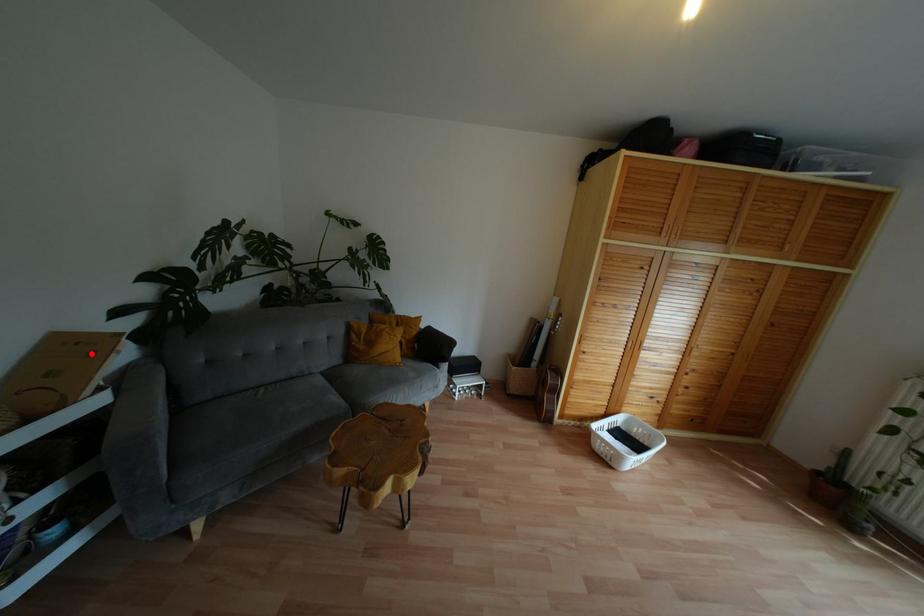
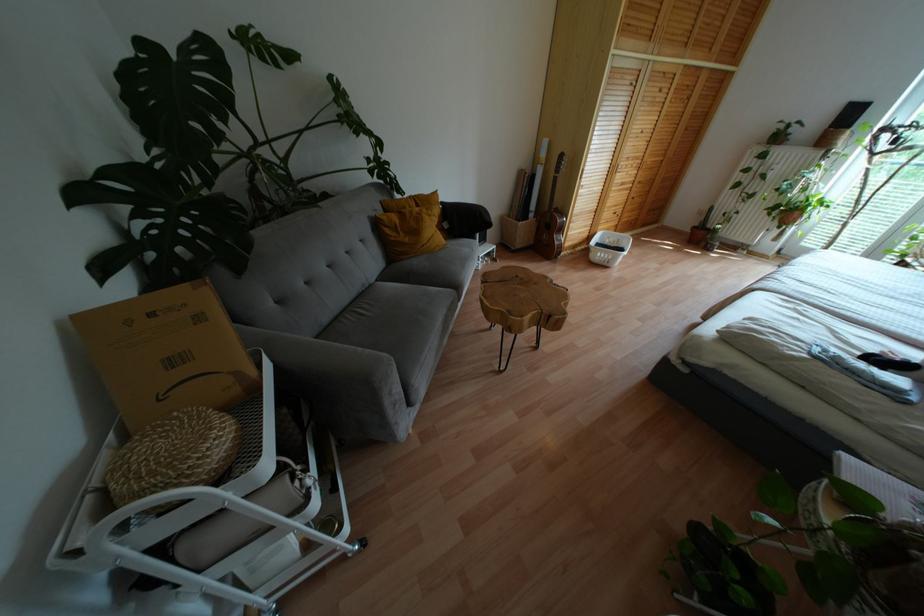
In the second image, find the point that corresponds to the highlighted location in the first image.

(199, 317)